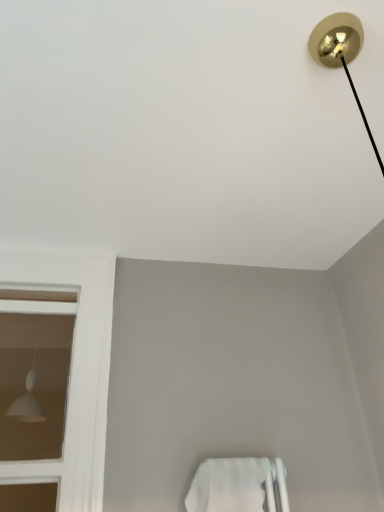
Identify the location of white matte towel bar at lower center. (239, 486).

Measure the distance between white matte towel bar at lower center and camera.

A distance of 1.23 meters exists between white matte towel bar at lower center and camera.

What do you see at coordinates (239, 486) in the screenshot? This screenshot has width=384, height=512. I see `white matte towel bar at lower center` at bounding box center [239, 486].

Describe the element at coordinates (72, 367) in the screenshot. I see `white matte lampshade at left` at that location.

Locate an element on the screen. The width and height of the screenshot is (384, 512). white matte lampshade at left is located at coordinates (72, 367).

The height and width of the screenshot is (512, 384). I want to click on white matte towel bar at lower center, so click(239, 486).

Can you confirm if white matte towel bar at lower center is positioned to the left of white matte lampshade at left?

Incorrect, white matte towel bar at lower center is not on the left side of white matte lampshade at left.

Which object is more forward, white matte towel bar at lower center or white matte lampshade at left?

white matte towel bar at lower center is in front.

Does point (189, 503) come in front of point (58, 249)?

Yes, it is in front of point (58, 249).

From the image's perspective, is white matte towel bar at lower center positioned above or below white matte lampshade at left?

Clearly, from the image's perspective, white matte towel bar at lower center is below white matte lampshade at left.

From a real-world perspective, who is located higher, white matte towel bar at lower center or white matte lampshade at left?

From a 3D spatial view, white matte lampshade at left is above.

Is white matte towel bar at lower center wider than white matte lampshade at left?

Yes, white matte towel bar at lower center is wider than white matte lampshade at left.

Is white matte towel bar at lower center shorter than white matte lampshade at left?

Correct, white matte towel bar at lower center is not as tall as white matte lampshade at left.

Considering the sizes of white matte towel bar at lower center and white matte lampshade at left in the image, is white matte towel bar at lower center bigger or smaller than white matte lampshade at left?

In the image, white matte towel bar at lower center appears to be smaller than white matte lampshade at left.

Is white matte towel bar at lower center completely or partially outside of white matte lampshade at left?

Yes.

Is white matte towel bar at lower center with white matte lampshade at left?

white matte towel bar at lower center and white matte lampshade at left are clearly separated.

Does white matte towel bar at lower center turn towards white matte lampshade at left?

No, white matte towel bar at lower center is not turned towards white matte lampshade at left.

Can you tell me how much white matte towel bar at lower center and white matte lampshade at left differ in facing direction?

0.0525 degrees separate the facing orientations of white matte towel bar at lower center and white matte lampshade at left.

I want to click on bay window above the white matte towel bar at lower center (from the image's perspective), so point(72,367).

Between white matte lampshade at left and white matte towel bar at lower center, which one appears on the left side from the viewer's perspective?

Positioned to the left is white matte lampshade at left.

Between white matte lampshade at left and white matte towel bar at lower center, which one is positioned behind?

white matte lampshade at left.

Is point (48, 463) closer or farther from the camera than point (260, 476)?

Clearly, point (48, 463) is more distant from the camera than point (260, 476).

From the image's perspective, is white matte lampshade at left above white matte towel bar at lower center?

Yes, from the image's perspective, white matte lampshade at left is on top of white matte towel bar at lower center.

From a real-world perspective, is white matte lampshade at left on top of white matte towel bar at lower center?

Correct, in the physical world, white matte lampshade at left is higher than white matte towel bar at lower center.

Looking at this image, in terms of width, does white matte lampshade at left look wider or thinner when compared to white matte towel bar at lower center?

white matte lampshade at left is thinner than white matte towel bar at lower center.

Considering the relative sizes of white matte lampshade at left and white matte towel bar at lower center in the image provided, is white matte lampshade at left taller than white matte towel bar at lower center?

Yes.

Is white matte lampshade at left bigger than white matte towel bar at lower center?

Yes, white matte lampshade at left is bigger than white matte towel bar at lower center.

Is white matte lampshade at left not within white matte towel bar at lower center?

Yes, white matte lampshade at left is outside of white matte towel bar at lower center.

Is white matte lampshade at left next to white matte towel bar at lower center?

No, white matte lampshade at left is not with white matte towel bar at lower center.

Is white matte lampshade at left facing away from white matte towel bar at lower center?

white matte lampshade at left does not have its back to white matte towel bar at lower center.

What's the angular difference between white matte lampshade at left and white matte towel bar at lower center's facing directions?

There is a 0.0525-degree angle between the facing directions of white matte lampshade at left and white matte towel bar at lower center.

This screenshot has width=384, height=512. I want to click on towel bar that appears below the white matte lampshade at left (from a real-world perspective), so click(239, 486).

I want to click on bay window above the white matte towel bar at lower center (from a real-world perspective), so click(x=72, y=367).

Image resolution: width=384 pixels, height=512 pixels. I want to click on towel bar beneath the white matte lampshade at left (from a real-world perspective), so click(239, 486).